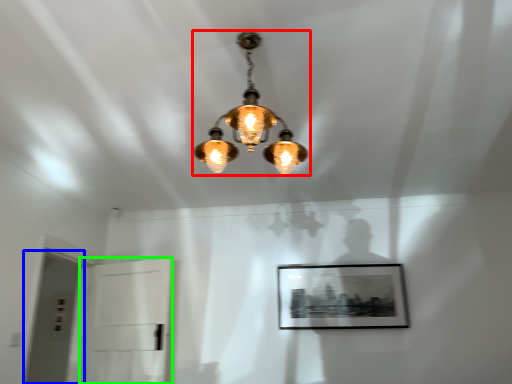
Question: Which is farther away from lamp (highlighted by a red box)? glass door (highlighted by a blue box) or glass door (highlighted by a green box)?

Choices:
 (A) glass door
 (B) glass door

Answer: (A)